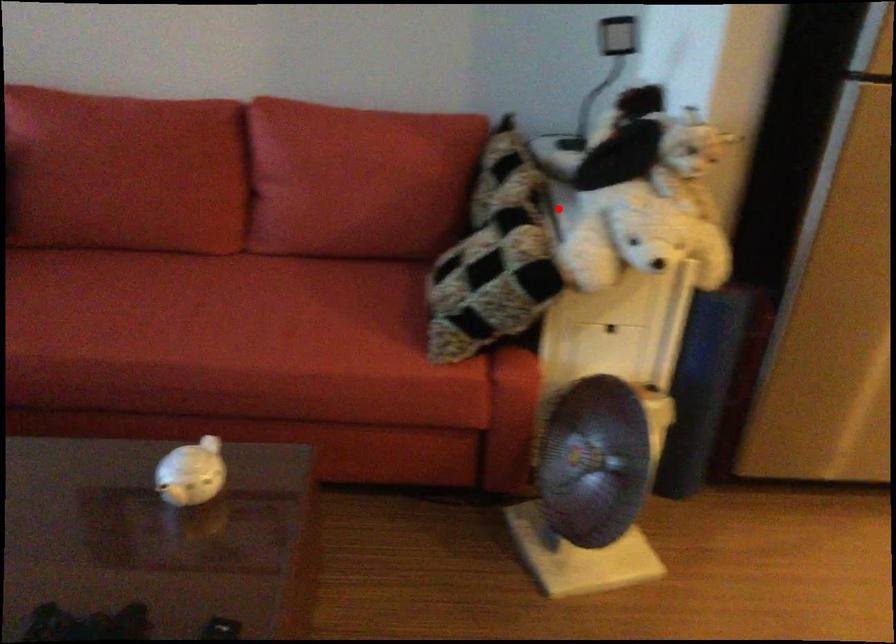
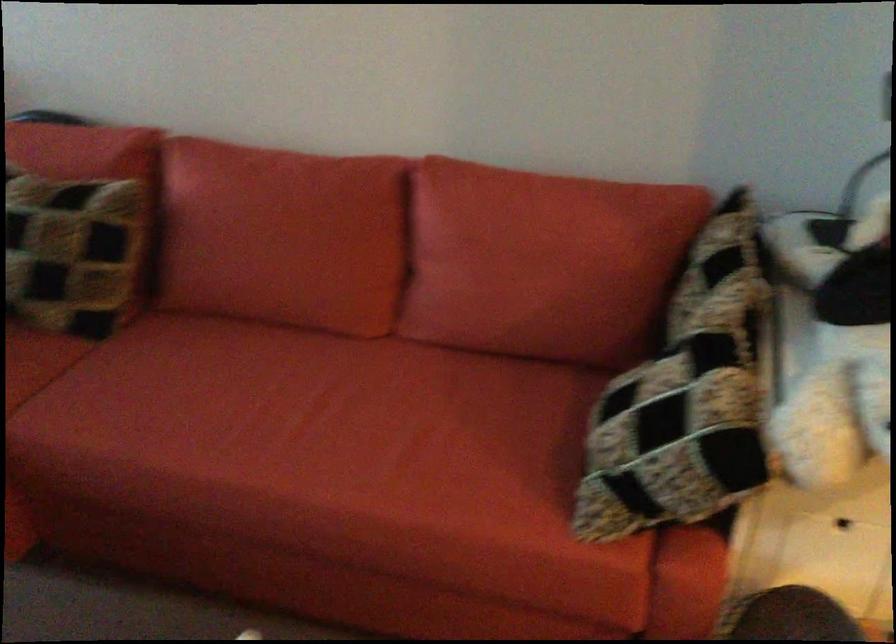
Find the pixel in the second image that matches the highlighted location in the first image.

(787, 341)